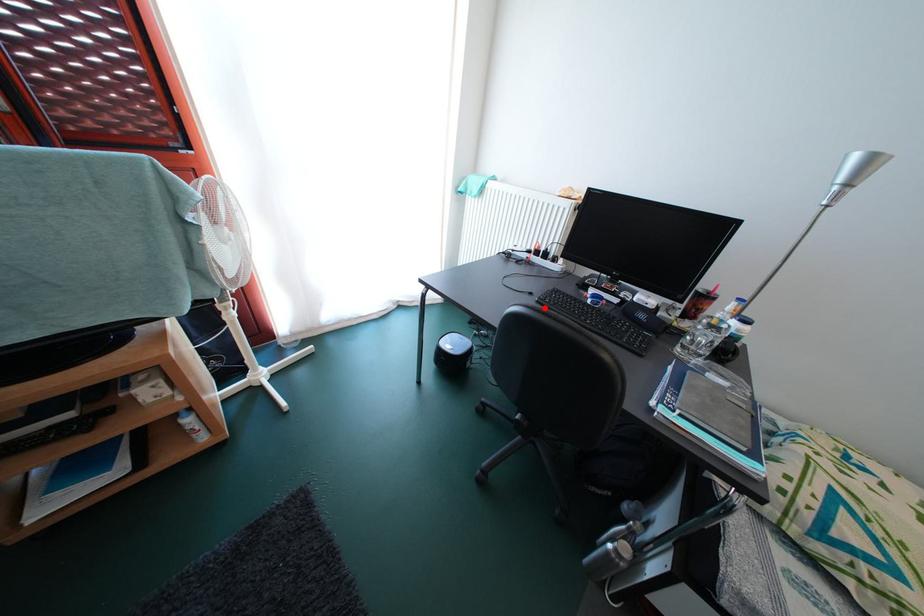
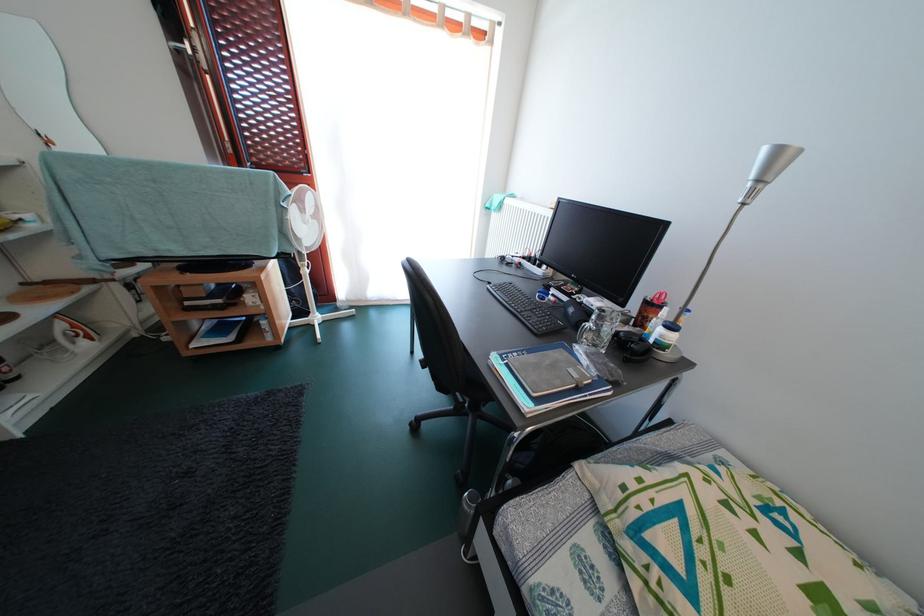
Find the pixel in the second image that matches the highlighted location in the first image.

(495, 294)